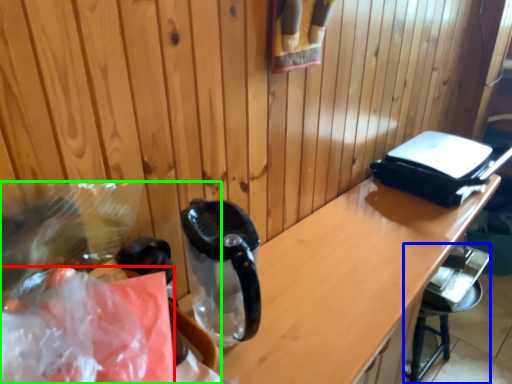
Question: Which object is the farthest from plastic bag (highlighted by a red box)? Choose among these: bar stool (highlighted by a blue box) or waste (highlighted by a green box).

Choices:
 (A) bar stool
 (B) waste

Answer: (A)